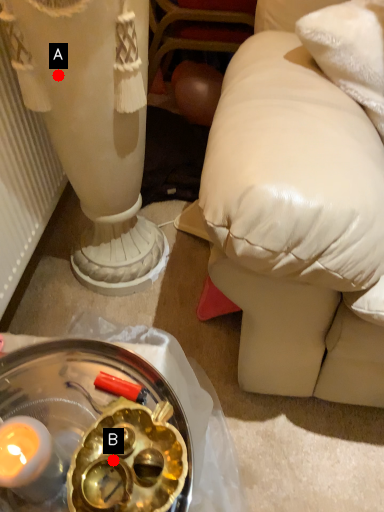
Question: Two points are circled on the image, labeled by A and B beside each circle. Which point is further to the camera?

Choices:
 (A) A is further
 (B) B is further

Answer: (A)